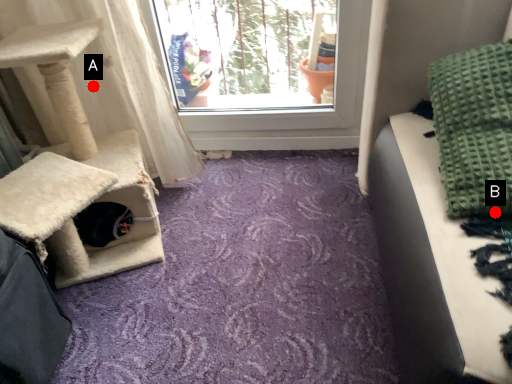
Question: Two points are circled on the image, labeled by A and B beside each circle. Which point is further to the camera?

Choices:
 (A) A is further
 (B) B is further

Answer: (A)